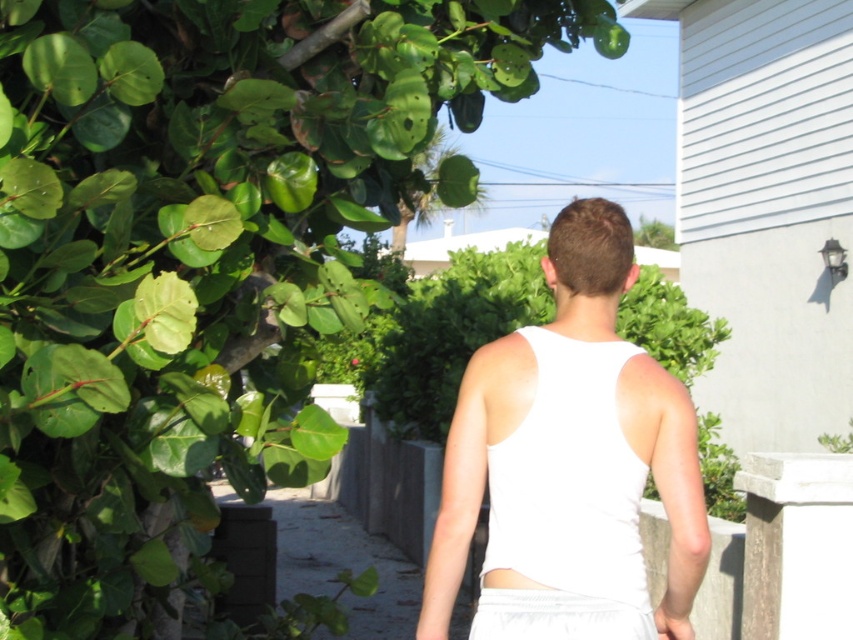
Can you confirm if green leafy tree at upper left is wider than white fabric tank top at center?

Indeed, green leafy tree at upper left has a greater width compared to white fabric tank top at center.

Can you confirm if green leafy tree at upper left is positioned to the left of white fabric tank top at center?

Indeed, green leafy tree at upper left is positioned on the left side of white fabric tank top at center.

Where is `green leafy tree at upper left`? The width and height of the screenshot is (853, 640). green leafy tree at upper left is located at coordinates (202, 256).

Between white fabric tank top at center and white matte vest at center, which one is positioned higher?

white fabric tank top at center

Identify the location of white fabric tank top at center. click(x=625, y=522).

The image size is (853, 640). In order to click on white fabric tank top at center in this screenshot , I will do `click(625, 522)`.

Who is positioned more to the right, green leafy tree at upper left or white fabric shorts at center?

white fabric shorts at center

Is green leafy tree at upper left to the left of white fabric shorts at center from the viewer's perspective?

Yes, green leafy tree at upper left is to the left of white fabric shorts at center.

Who is more forward, [131,592] or [547,592]?

Point [547,592] is in front.

At what (x,y) coordinates should I click in order to perform the action: click on green leafy tree at upper left. Please return your answer as a coordinate pair (x, y). This screenshot has height=640, width=853. Looking at the image, I should click on (202, 256).